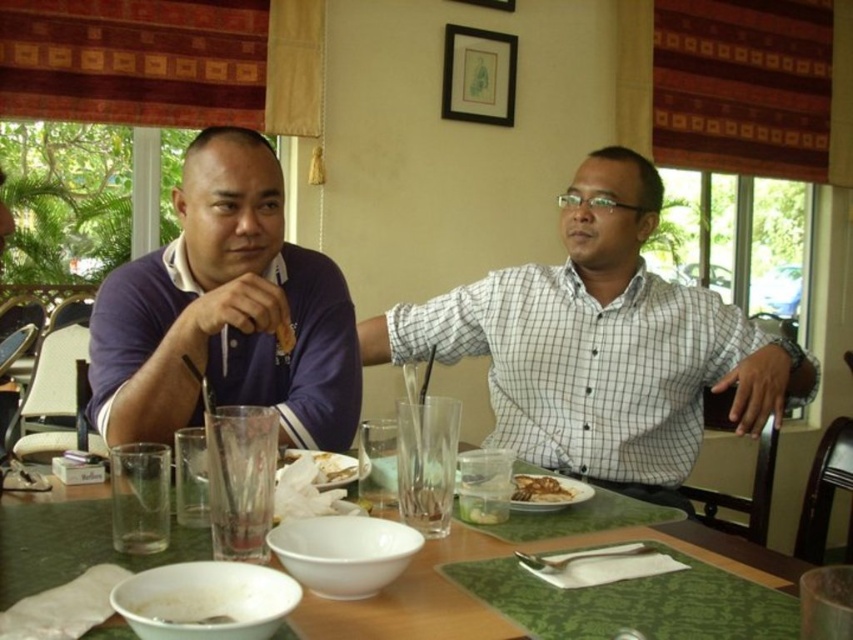
You are a waiter in a restaurant and need to place a new drink order between the two points on the table, point (357, 356) and point (241, 598). Since you want the drink to be closer to the customer who is speaking, which point should you choose?

You should place the drink at point (241, 598) because it is closer to the customer who is speaking, as point (357, 356) is further away from the viewer and thus further from the speaker.

You are a waiter in this restaurant and need to place a new drink order for the customer wearing the purple cotton polo shirt at left. Where should you place the drink relative to the white matte bowl at lower left?

The purple cotton polo shirt at left is much taller than the white matte bowl at lower left, so you should place the drink in front of the white matte bowl at lower left to avoid blocking the customer.